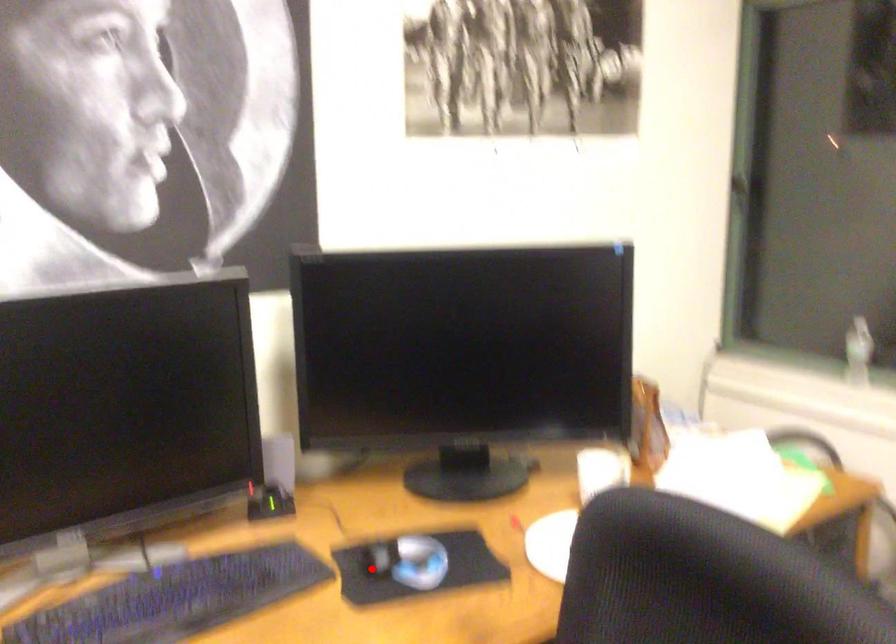
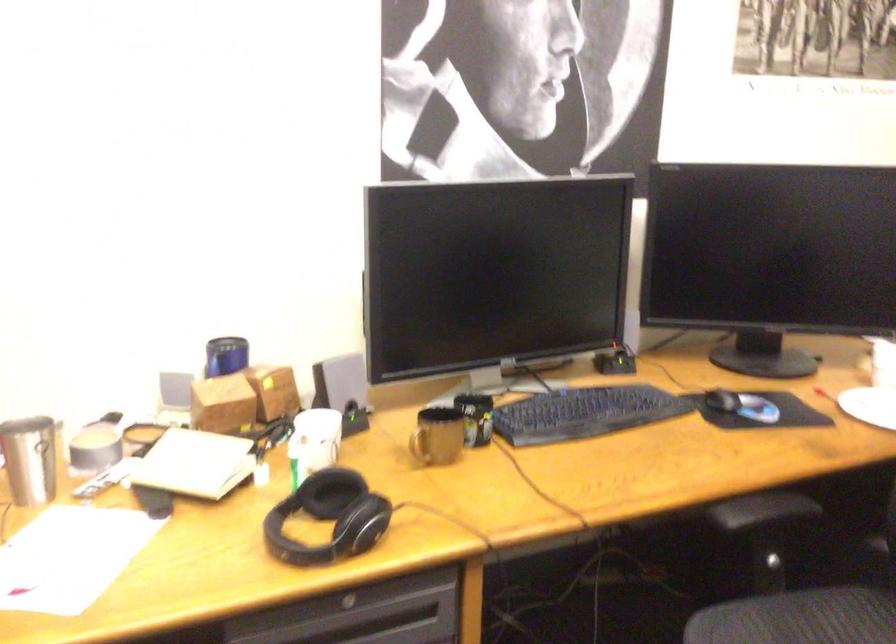
Locate, in the second image, the point that corresponds to the highlighted location in the first image.

(721, 400)